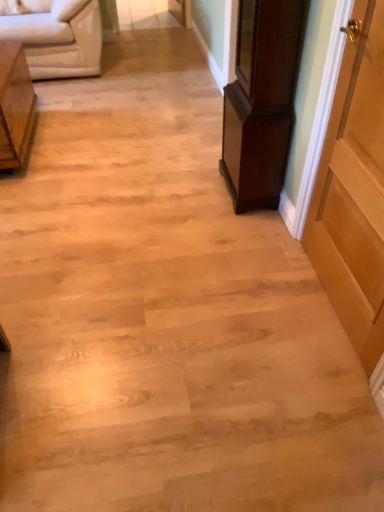
This screenshot has height=512, width=384. Identify the location of free space in front of light brown wood door at right. pyautogui.click(x=306, y=389).